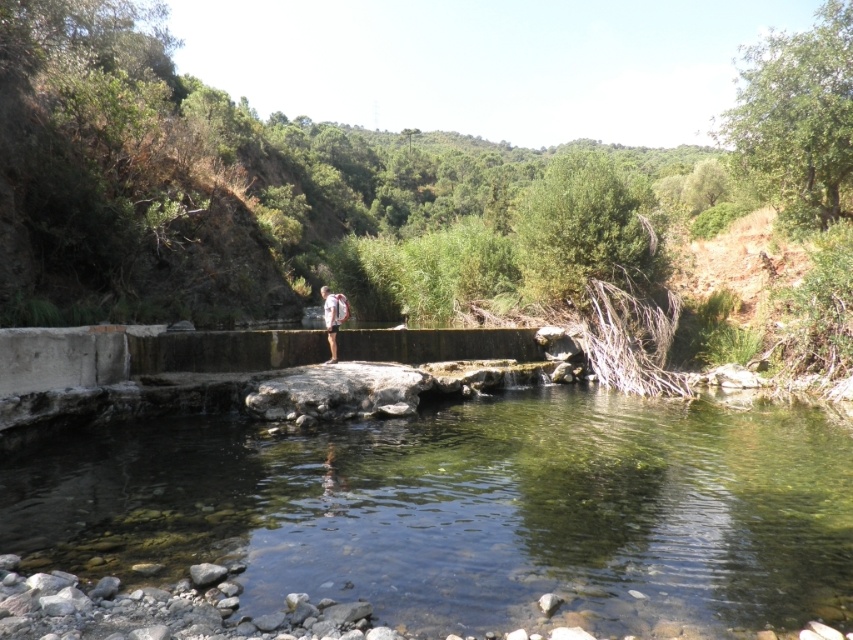
You are a hiker who wants to cross the stream safely. You see the clear water at center and the light brown fabric shorts at center. Which object is positioned to the right of the other?

The clear water at center is to the right of the light brown fabric shorts at center.

You are a photographer positioned at the camera location. You want to capture both the point at coordinates point (x=515, y=410) and point (x=325, y=310) in your shot. Which point will appear closer to the front of the photo?

Point (x=515, y=410) is further to the camera than point (x=325, y=310), so it will appear closer to the front of the photo.